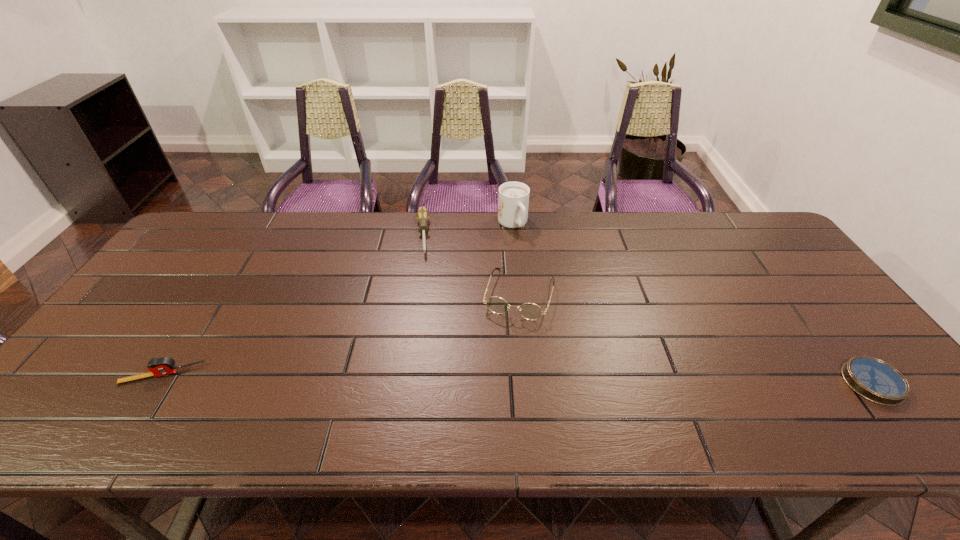
Image resolution: width=960 pixels, height=540 pixels. I want to click on tape measure at the near edge, so click(x=161, y=366).

This screenshot has width=960, height=540. Identify the location of compass present at the near edge. (875, 380).

Locate an element on the screen. Image resolution: width=960 pixels, height=540 pixels. object located at the left edge is located at coordinates (161, 366).

The height and width of the screenshot is (540, 960). What are the coordinates of `object that is at the right edge` in the screenshot? It's located at (875, 380).

At what (x,y) coordinates should I click in order to perform the action: click on object at the near left corner. Please return your answer as a coordinate pair (x, y). Looking at the image, I should click on (161, 366).

I want to click on object situated at the near right corner, so click(875, 380).

Locate an element on the screen. blank space at the far edge is located at coordinates (502, 246).

At what (x,y) coordinates should I click in order to perform the action: click on free space at the near edge. Please return your answer as a coordinate pair (x, y). Looking at the image, I should click on (309, 384).

Image resolution: width=960 pixels, height=540 pixels. Find the location of `blank space at the left edge of the desktop`. blank space at the left edge of the desktop is located at coordinates (130, 366).

This screenshot has width=960, height=540. Identify the location of free space at the far right corner. (760, 227).